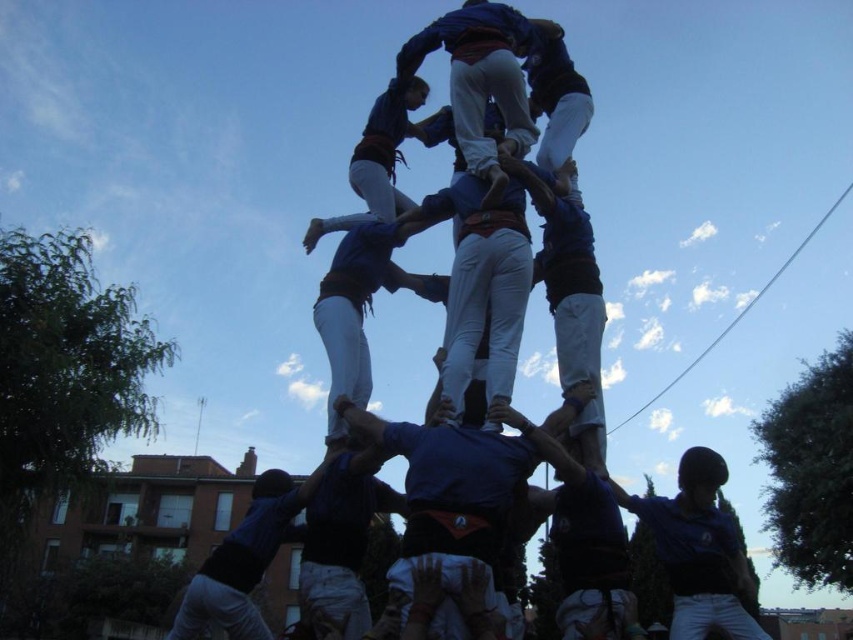
Can you confirm if blue fabric helmet at center is positioned below blue fabric man at center?

No, blue fabric helmet at center is not below blue fabric man at center.

Does blue fabric helmet at center come behind blue fabric man at center?

No, blue fabric helmet at center is closer to the viewer.

Does point (734, 572) lie behind point (222, 540)?

That is False.

I want to click on blue fabric helmet at center, so click(x=698, y=550).

Is blue fabric human at center bigger than blue fabric helmet at center?

No.

Can you confirm if blue fabric human at center is wider than blue fabric helmet at center?

Yes, blue fabric human at center is wider than blue fabric helmet at center.

Where is `blue fabric human at center`? The image size is (853, 640). blue fabric human at center is located at coordinates (480, 189).

Is blue fabric human at center shorter than blue fabric man at center?

Indeed, blue fabric human at center has a lesser height compared to blue fabric man at center.

Can you confirm if blue fabric human at center is positioned below blue fabric man at center?

No, blue fabric human at center is not below blue fabric man at center.

Between point (506, 234) and point (242, 516), which one is positioned in front?

Point (506, 234) is in front.

Identify the location of blue fabric human at center. The height and width of the screenshot is (640, 853). coord(480,189).